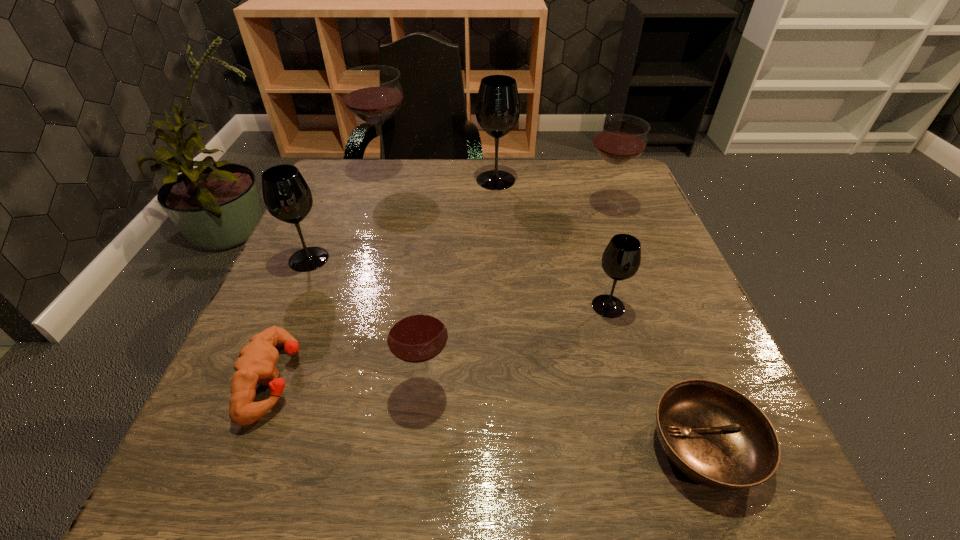
Find the location of a particular element. The width and height of the screenshot is (960, 540). the smallest gray wineglass is located at coordinates point(621,259).

The image size is (960, 540). Find the location of `the fifth farthest object`. the fifth farthest object is located at coordinates (621, 259).

The image size is (960, 540). What are the coordinates of `red puncher` in the screenshot? It's located at (256, 364).

Locate an element on the screen. puncher is located at coordinates (256, 364).

The width and height of the screenshot is (960, 540). Find the location of `the shortest object`. the shortest object is located at coordinates 715,435.

The height and width of the screenshot is (540, 960). I want to click on vacant area situated 0.260m on the front of the third wineglass from right to left, so click(x=500, y=257).

At what (x,y) coordinates should I click in order to perform the action: click on vacant region located on the front of the leftmost red wineglass. Please return your answer as a coordinate pair (x, y). The height and width of the screenshot is (540, 960). Looking at the image, I should click on (349, 291).

Where is `vacant space situated 0.270m on the left of the second farthest red wineglass`? vacant space situated 0.270m on the left of the second farthest red wineglass is located at coordinates (471, 205).

Find the location of a particular element. vacant space located on the back of the third nearest wineglass is located at coordinates (321, 232).

At what (x,y) coordinates should I click in order to perform the action: click on vacant point located 0.330m on the back of the second red wineglass from right to left. Please return your answer as a coordinate pair (x, y). The height and width of the screenshot is (540, 960). Looking at the image, I should click on (441, 240).